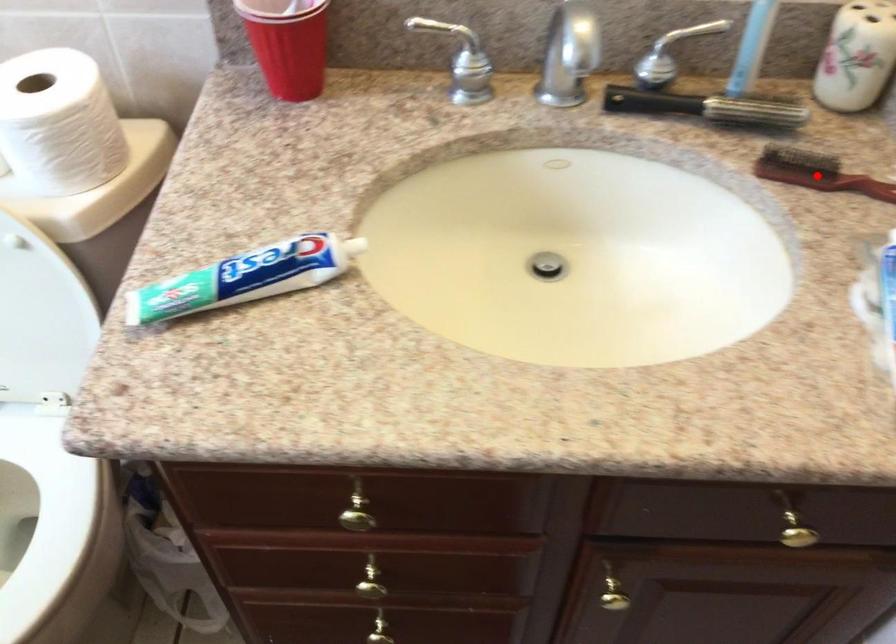
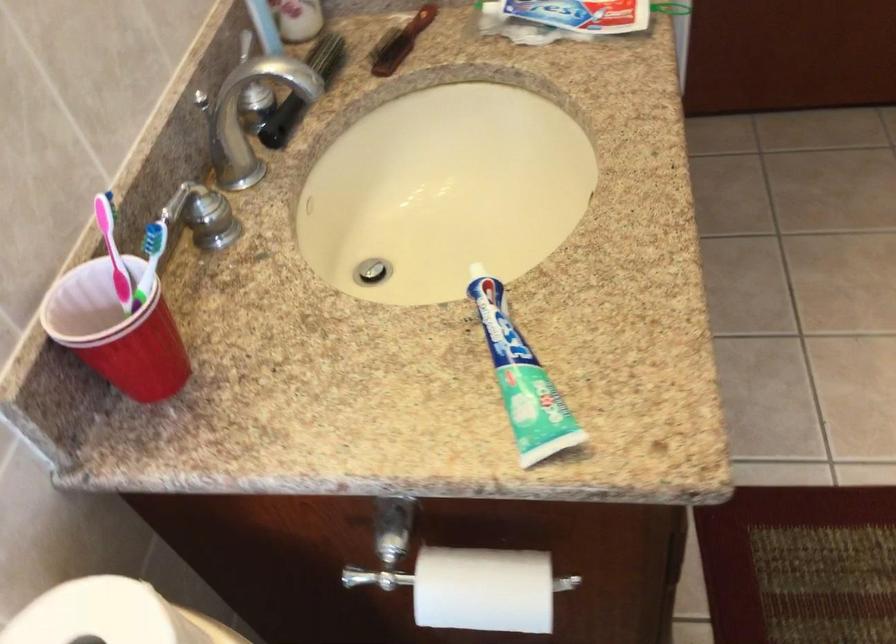
In the second image, find the point that corresponds to the highlighted location in the first image.

(400, 42)